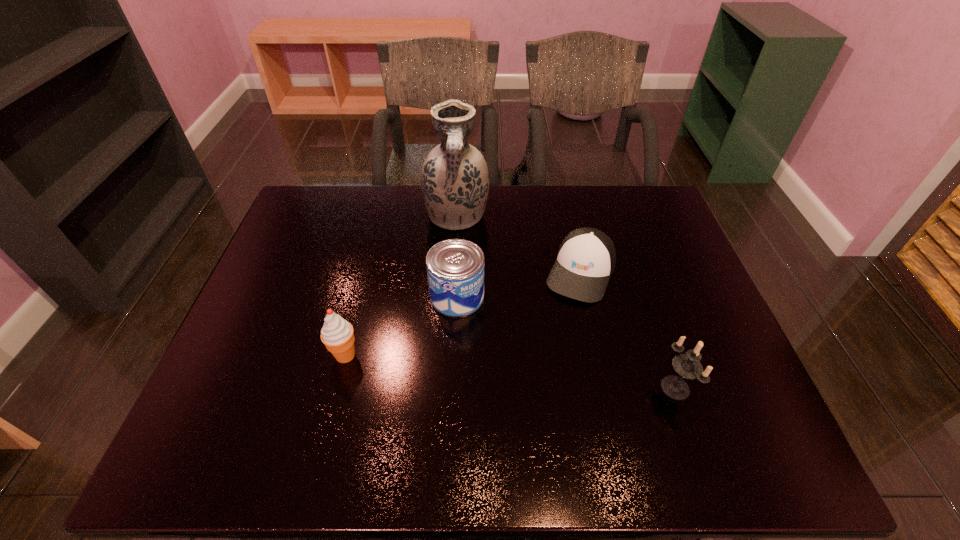
Locate an element on the screen. The height and width of the screenshot is (540, 960). vacant area that satisfies the following two spatial constraints: 1. on the back side of the second nearest object; 2. on the right side of the shortest object is located at coordinates (366, 273).

This screenshot has height=540, width=960. Find the location of `vacant area that satisfies the following two spatial constraints: 1. on the front side of the fourth farthest object; 2. on the left side of the nearest object`. vacant area that satisfies the following two spatial constraints: 1. on the front side of the fourth farthest object; 2. on the left side of the nearest object is located at coordinates (337, 387).

At what (x,y) coordinates should I click in order to perform the action: click on free space that satisfies the following two spatial constraints: 1. on the front side of the tallest object; 2. on the left side of the shortest object. Please return your answer as a coordinate pair (x, y). This screenshot has height=540, width=960. Looking at the image, I should click on (453, 273).

At what (x,y) coordinates should I click in order to perform the action: click on free point that satisfies the following two spatial constraints: 1. on the front side of the rightmost object; 2. on the right side of the icecream. Please return your answer as a coordinate pair (x, y). The height and width of the screenshot is (540, 960). Looking at the image, I should click on (337, 387).